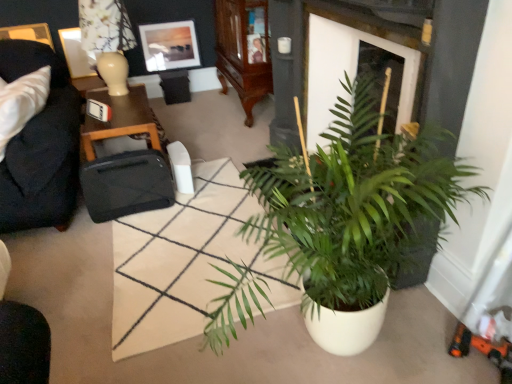
Question: Should I look upward or downward to see wooden cabinet at upper center?

Choices:
 (A) up
 (B) down

Answer: (A)

Question: Does dark blue fabric couch at left have a larger size compared to wooden cabinet at upper center?

Choices:
 (A) no
 (B) yes

Answer: (A)

Question: Is dark blue fabric couch at left to the left of wooden cabinet at upper center from the viewer's perspective?

Choices:
 (A) yes
 (B) no

Answer: (A)

Question: Are dark blue fabric couch at left and wooden cabinet at upper center far apart?

Choices:
 (A) no
 (B) yes

Answer: (B)

Question: From the image's perspective, does dark blue fabric couch at left appear higher than wooden cabinet at upper center?

Choices:
 (A) no
 (B) yes

Answer: (A)

Question: Is dark blue fabric couch at left closer to the viewer compared to wooden cabinet at upper center?

Choices:
 (A) no
 (B) yes

Answer: (B)

Question: From a real-world perspective, is dark blue fabric couch at left below wooden cabinet at upper center?

Choices:
 (A) no
 (B) yes

Answer: (A)

Question: Is green matte plant at center surrounding green leafy plant at center?

Choices:
 (A) no
 (B) yes

Answer: (A)

Question: Is green matte plant at center further to the viewer compared to green leafy plant at center?

Choices:
 (A) no
 (B) yes

Answer: (A)

Question: From the image's perspective, does green matte plant at center appear higher than green leafy plant at center?

Choices:
 (A) yes
 (B) no

Answer: (A)

Question: Does green matte plant at center come in front of green leafy plant at center?

Choices:
 (A) yes
 (B) no

Answer: (A)

Question: Is green matte plant at center shorter than green leafy plant at center?

Choices:
 (A) yes
 (B) no

Answer: (B)

Question: Is green matte plant at center not close to green leafy plant at center?

Choices:
 (A) yes
 (B) no

Answer: (B)

Question: Is dark blue fabric couch at left positioned behind green matte plant at center?

Choices:
 (A) no
 (B) yes

Answer: (B)